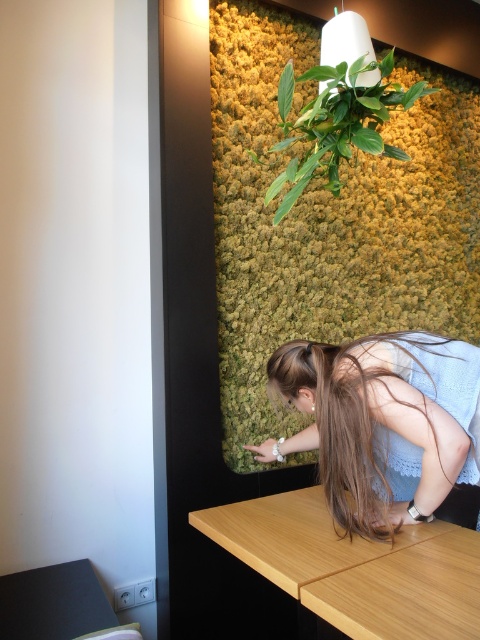
You are standing in the room and want to place a 12 inch tall vase on the light wood table at lower center. Can you reach the table to place it without moving?

The light wood table at lower center and viewer are 38.38 inches apart from each other. Since the distance is within typical reaching range, you can likely reach the table to place the vase without moving.

Looking at this image, you are organizing a photoshoot and need to position a model between the blue lace dress at center and the light wood table at lower center. According to the scene description, which object should the model stand closer to if they want to face the camera positioned to the right of the scene?

The model should stand closer to the light wood table at lower center because the blue lace dress at center is already positioned to the right of the light wood table at lower center, so moving towards the table would keep them centered relative to the camera on the right.

You are a fashion designer observing the modern interior space. You see the blue lace dress at center and the green leafy plant at upper center. Which object is wider?

The blue lace dress at center is wider than the green leafy plant at upper center according to the description.